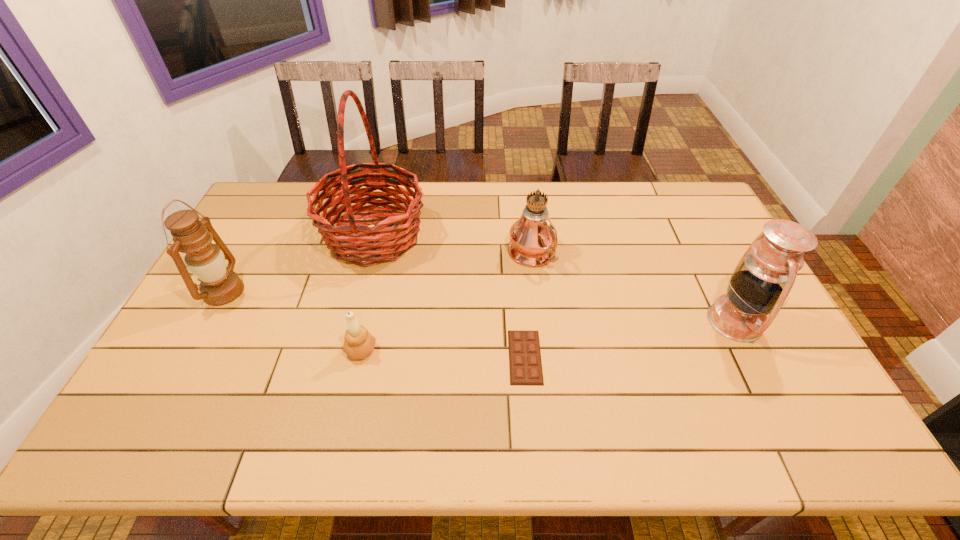
Locate an element on the screen. basket is located at coordinates (360, 244).

Locate an element on the screen. the second tallest object is located at coordinates (533, 238).

What are the coordinates of `the second oil lamp from left to right` in the screenshot? It's located at (533, 238).

Identify the location of the rightmost object. The image size is (960, 540). (763, 278).

This screenshot has width=960, height=540. I want to click on the leftmost oil lamp, so click(205, 260).

Where is `candle_holder`? The width and height of the screenshot is (960, 540). candle_holder is located at coordinates (359, 343).

I want to click on the shortest object, so click(525, 365).

This screenshot has width=960, height=540. What are the coordinates of `vacant area situated 0.300m on the handle side of the tallest object` in the screenshot? It's located at (517, 235).

This screenshot has width=960, height=540. Find the location of `free location located on the left of the fifth shortest object`. free location located on the left of the fifth shortest object is located at coordinates (x=470, y=254).

This screenshot has width=960, height=540. Identify the location of vacant region located on the front of the rightmost object. (785, 420).